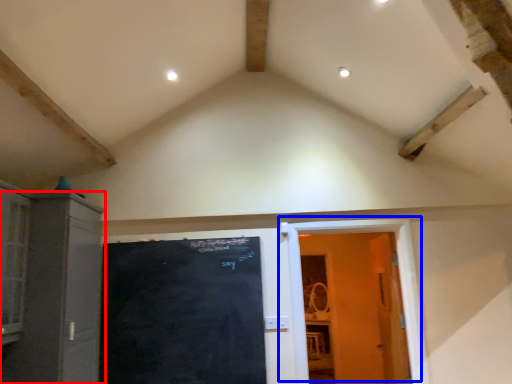
Question: Which of the following is the farthest to the observer, cabinetry (highlighted by a red box) or door (highlighted by a blue box)?

Choices:
 (A) cabinetry
 (B) door

Answer: (B)